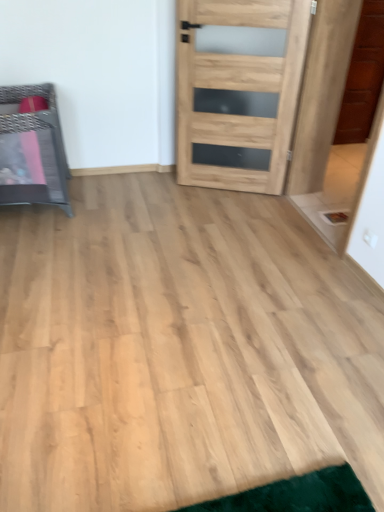
Question: From a real-world perspective, is metallic woven basket at left under natural wood door at center?

Choices:
 (A) no
 (B) yes

Answer: (B)

Question: From the image's perspective, is metallic woven basket at left on natural wood door at center?

Choices:
 (A) no
 (B) yes

Answer: (A)

Question: From the image's perspective, is metallic woven basket at left under natural wood door at center?

Choices:
 (A) no
 (B) yes

Answer: (B)

Question: Is metallic woven basket at left oriented towards natural wood door at center?

Choices:
 (A) yes
 (B) no

Answer: (B)

Question: Is metallic woven basket at left smaller than natural wood door at center?

Choices:
 (A) no
 (B) yes

Answer: (A)

Question: Is metallic woven basket at left outside of natural wood door at center?

Choices:
 (A) yes
 (B) no

Answer: (A)

Question: Is natural wood door at center touching metallic woven basket at left?

Choices:
 (A) no
 (B) yes

Answer: (A)

Question: From the image's perspective, is natural wood door at center on metallic woven basket at left?

Choices:
 (A) no
 (B) yes

Answer: (B)

Question: From the image's perspective, would you say natural wood door at center is shown under metallic woven basket at left?

Choices:
 (A) yes
 (B) no

Answer: (B)

Question: From a real-world perspective, is natural wood door at center under metallic woven basket at left?

Choices:
 (A) no
 (B) yes

Answer: (A)

Question: Considering the relative sizes of natural wood door at center and metallic woven basket at left in the image provided, is natural wood door at center wider than metallic woven basket at left?

Choices:
 (A) yes
 (B) no

Answer: (B)

Question: From a real-world perspective, is natural wood door at center positioned over metallic woven basket at left based on gravity?

Choices:
 (A) yes
 (B) no

Answer: (A)

Question: Does point (230, 3) appear closer or farther from the camera than point (34, 201)?

Choices:
 (A) closer
 (B) farther

Answer: (A)